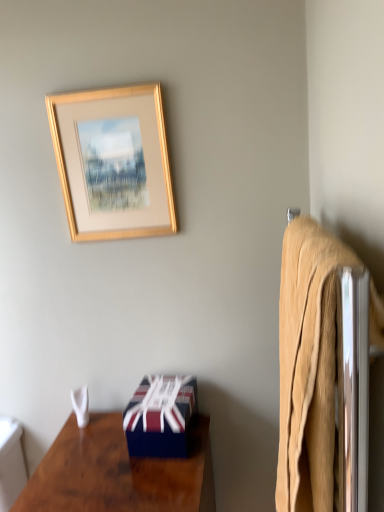
In order to click on vacant space situated above shiny dark wood desk at lower left (from a real-world perspective) in this screenshot , I will do `click(110, 464)`.